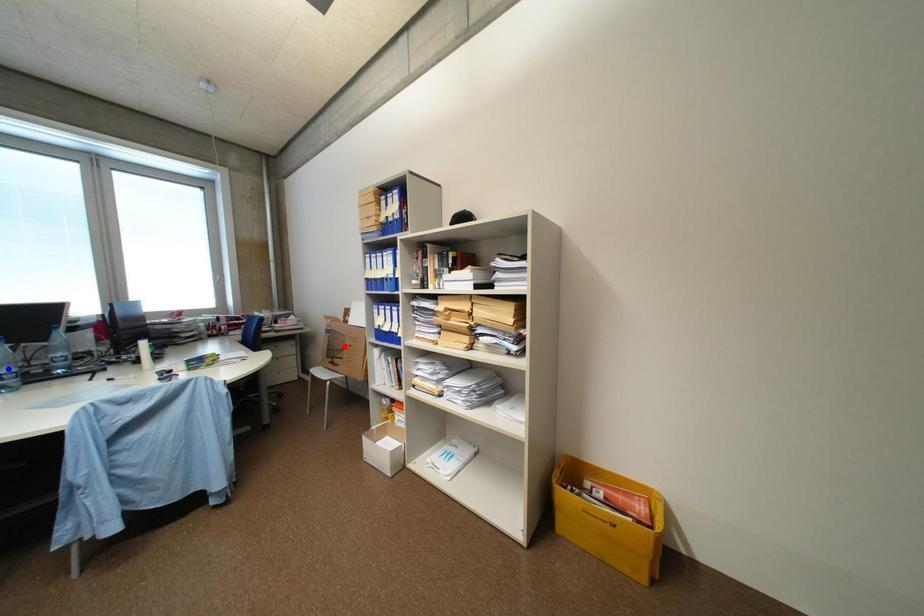
Question: In the image, two points are highlighted. Which point is nearer to the camera? Reply with the corresponding letter.

Choices:
 (A) blue point
 (B) red point

Answer: (A)